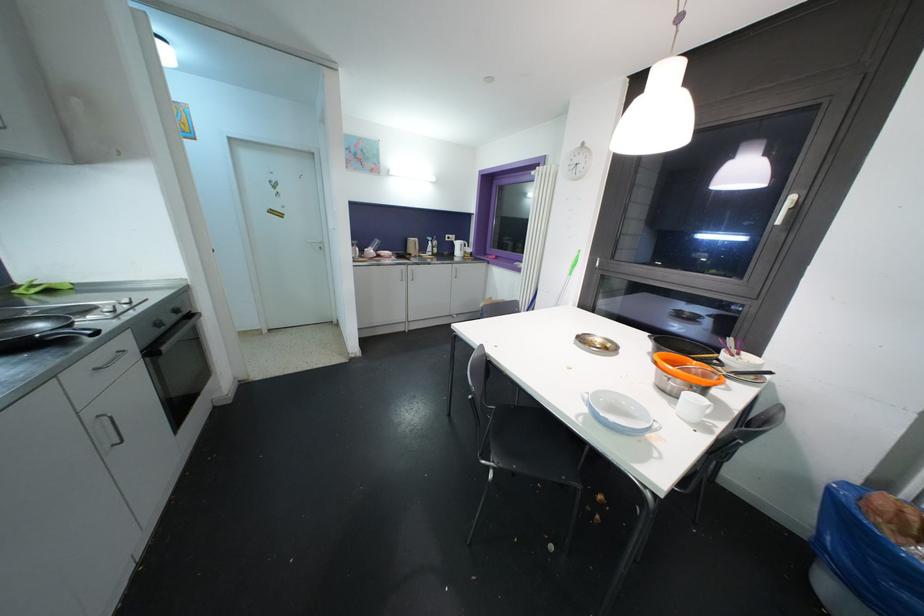
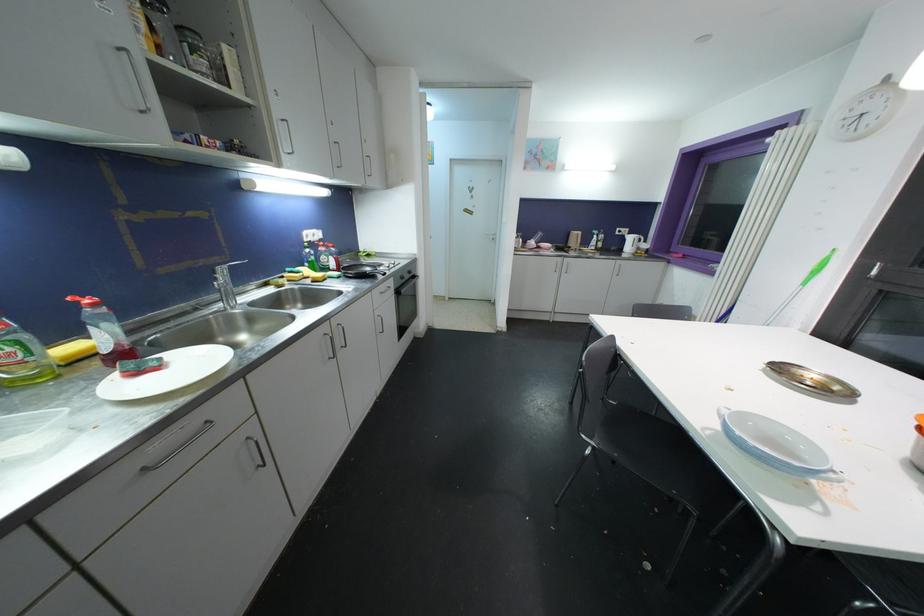
Where in the second image is the point corresponding to the point at 153,355 from the first image?

(400, 294)